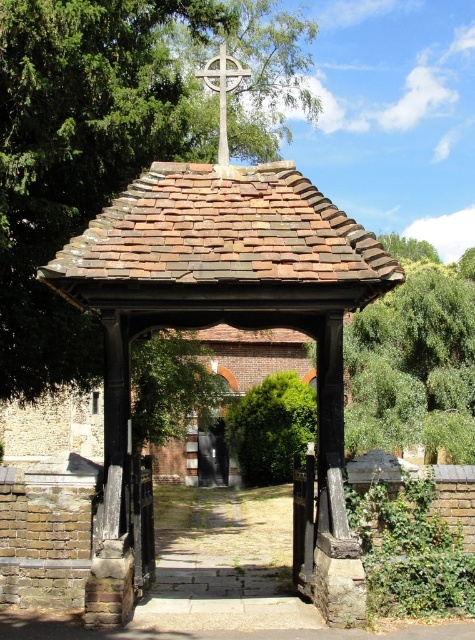
Between point (126, 337) and point (74, 54), which one is positioned behind?

Positioned behind is point (74, 54).

Is point (215, 186) farther from viewer compared to point (155, 72)?

No, (215, 186) is closer to viewer.

Locate an element on the screen. brown tiled gazebo at center is located at coordinates (227, 323).

Who is positioned more to the right, green leafy tree at center or white stone cross at upper center?

white stone cross at upper center

Which of these two, green leafy tree at center or white stone cross at upper center, stands taller?

green leafy tree at center

This screenshot has width=475, height=640. Describe the element at coordinates (113, 140) in the screenshot. I see `green leafy tree at center` at that location.

You are a GUI agent. You are given a task and a screenshot of the screen. Output one action in this format:
    pyautogui.click(x=<x>, y=<y>)
    Task: Click on the green leafy tree at center
    
    Given the screenshot: What is the action you would take?
    pyautogui.click(x=113, y=140)

Based on the photo, can you confirm if brown tiled gazebo at center is smaller than white stone cross at upper center?

Indeed, brown tiled gazebo at center has a smaller size compared to white stone cross at upper center.

Is point (347, 305) closer to camera compared to point (210, 61)?

Yes, point (347, 305) is in front of point (210, 61).

Where is `brown tiled gazebo at center`? Image resolution: width=475 pixels, height=640 pixels. brown tiled gazebo at center is located at coordinates (227, 323).